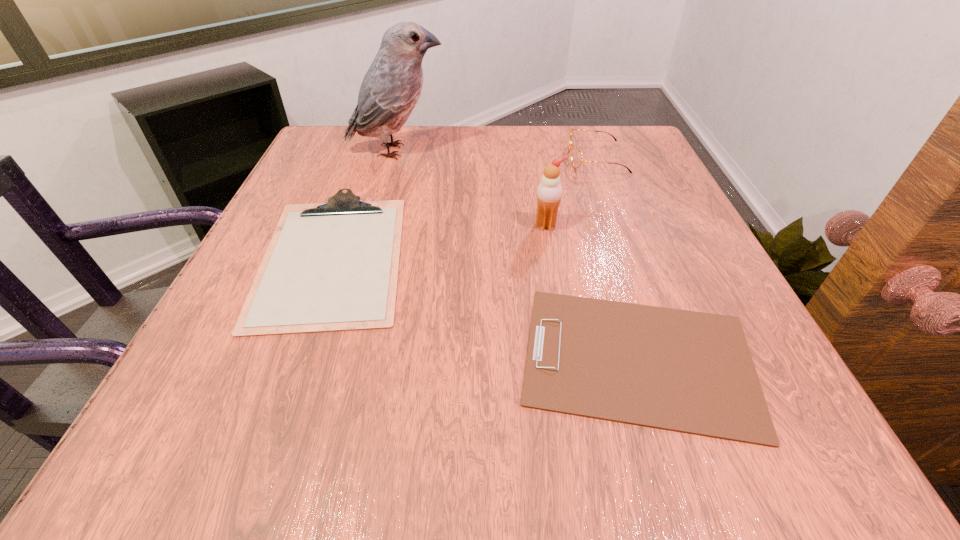
Find the location of a particular element. This screenshot has height=540, width=960. free spot that satisfies the following two spatial constraints: 1. on the front-facing side of the third tallest object; 2. at the front with a straw on the icecream is located at coordinates (621, 225).